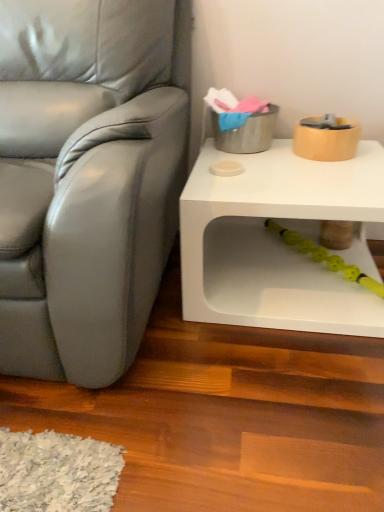
What do you see at coordinates (279, 241) in the screenshot?
I see `white matte table at lower right` at bounding box center [279, 241].

Identify the location of yellow rubber toy at lower center. This screenshot has height=512, width=384. (325, 257).

Is white matte table at lower right located within satin gray leather chair at left?

No, white matte table at lower right is not a part of satin gray leather chair at left.

From the picture: Considering the sizes of objects satin gray leather chair at left and white matte table at lower right in the image provided, who is bigger, satin gray leather chair at left or white matte table at lower right?

Bigger between the two is satin gray leather chair at left.

From the image's perspective, is satin gray leather chair at left over white matte table at lower right?

Yes, from the image's perspective, satin gray leather chair at left is above white matte table at lower right.

What's the angular difference between satin gray leather chair at left and white matte table at lower right's facing directions?

The angular difference between satin gray leather chair at left and white matte table at lower right is 0.000323 degrees.

In the scene shown: From a real-world perspective, relative to satin gray leather chair at left, is yellow rubber toy at lower center vertically above or below?

In terms of real-world spatial position, yellow rubber toy at lower center is below satin gray leather chair at left.

Is yellow rubber toy at lower center aimed at satin gray leather chair at left?

No, yellow rubber toy at lower center does not turn towards satin gray leather chair at left.

Is yellow rubber toy at lower center taller or shorter than satin gray leather chair at left?

Clearly, yellow rubber toy at lower center is shorter compared to satin gray leather chair at left.

Looking at this image, which object is thinner, satin gray leather chair at left or yellow rubber toy at lower center?

Thinner between the two is yellow rubber toy at lower center.

From the picture: Which object is further away from the camera, satin gray leather chair at left or yellow rubber toy at lower center?

yellow rubber toy at lower center is further away from the camera.

Which point is more distant from viewer, (x=73, y=213) or (x=276, y=226)?

Positioned behind is point (x=276, y=226).

From the image's perspective, which one is positioned lower, satin gray leather chair at left or yellow rubber toy at lower center?

yellow rubber toy at lower center appears lower in the image.

In the scene shown: Is white matte table at lower right thinner than satin gray leather chair at left?

Indeed, white matte table at lower right has a lesser width compared to satin gray leather chair at left.

Which of these two, white matte table at lower right or satin gray leather chair at left, stands shorter?

Standing shorter between the two is white matte table at lower right.

From the image's perspective, between white matte table at lower right and satin gray leather chair at left, who is located below?

white matte table at lower right, from the image's perspective.

Is white matte table at lower right completely or partially outside of satin gray leather chair at left?

That's correct, white matte table at lower right is outside of satin gray leather chair at left.

Where is `table that is on the left side of yellow rubber toy at lower center`? table that is on the left side of yellow rubber toy at lower center is located at coordinates click(x=279, y=241).

How different are the orientations of white matte table at lower right and yellow rubber toy at lower center in degrees?

They differ by 0.000138 degrees in their facing directions.

Which object is closer to the camera, white matte table at lower right or yellow rubber toy at lower center?

white matte table at lower right is more forward.

Does white matte table at lower right touch yellow rubber toy at lower center?

No, white matte table at lower right is not next to yellow rubber toy at lower center.

How different are the orientations of yellow rubber toy at lower center and white matte table at lower right in degrees?

yellow rubber toy at lower center and white matte table at lower right are facing 0.000138 degrees away from each other.

Is yellow rubber toy at lower center to the left of white matte table at lower right from the viewer's perspective?

In fact, yellow rubber toy at lower center is to the right of white matte table at lower right.

Which is closer to the camera, [367,279] or [320,329]?

Point [367,279].

Is yellow rubber toy at lower center inside the boundaries of white matte table at lower right, or outside?

yellow rubber toy at lower center is inside white matte table at lower right.

Where is `table behind the satin gray leather chair at left`? table behind the satin gray leather chair at left is located at coordinates (279, 241).

Find the location of a particular element. The height and width of the screenshot is (512, 384). toy located below the satin gray leather chair at left (from the image's perspective) is located at coordinates (325, 257).

From the image, which object appears to be nearer to satin gray leather chair at left, white matte table at lower right or yellow rubber toy at lower center?

Based on the image, white matte table at lower right appears to be nearer to satin gray leather chair at left.

From the image, which object appears to be farther from satin gray leather chair at left, yellow rubber toy at lower center or white matte table at lower right?

Among the two, yellow rubber toy at lower center is located further to satin gray leather chair at left.

Considering their positions, is white matte table at lower right positioned closer to yellow rubber toy at lower center than satin gray leather chair at left?

white matte table at lower right lies closer to yellow rubber toy at lower center than the other object.

From the image, which object appears to be nearer to white matte table at lower right, satin gray leather chair at left or yellow rubber toy at lower center?

The object closer to white matte table at lower right is yellow rubber toy at lower center.

Considering their positions, is satin gray leather chair at left positioned closer to yellow rubber toy at lower center than white matte table at lower right?

white matte table at lower right.

From the image, which object appears to be nearer to white matte table at lower right, yellow rubber toy at lower center or satin gray leather chair at left?

yellow rubber toy at lower center is positioned closer to the anchor white matte table at lower right.

Where is `table situated between satin gray leather chair at left and yellow rubber toy at lower center from left to right`? The image size is (384, 512). table situated between satin gray leather chair at left and yellow rubber toy at lower center from left to right is located at coordinates (279, 241).